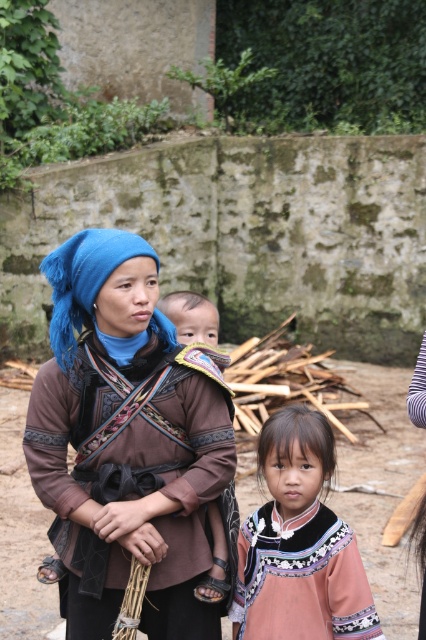
Who is positioned more to the left, blue fabric headdress at center or brown fabric baby at center?

blue fabric headdress at center

Is point (72, 280) more distant than point (198, 328)?

No.

Where is `blue fabric headdress at center`? blue fabric headdress at center is located at coordinates (83, 280).

The image size is (426, 640). What are the coordinates of `blue fabric headdress at center` in the screenshot? It's located at (83, 280).

Can you confirm if pink fabric dress at center is positioned to the left of blue fabric headdress at center?

No, pink fabric dress at center is not to the left of blue fabric headdress at center.

Which is behind, point (319, 518) or point (71, 324)?

The point (71, 324) is behind.

This screenshot has width=426, height=640. I want to click on pink fabric dress at center, so (299, 545).

Who is taller, matte brown fabric at center or brown fabric baby at center?

Standing taller between the two is matte brown fabric at center.

Does matte brown fabric at center lie in front of brown fabric baby at center?

Yes, matte brown fabric at center is in front of brown fabric baby at center.

You are a GUI agent. You are given a task and a screenshot of the screen. Output one action in this format:
    pyautogui.click(x=<x>, y=<y>)
    Task: Click on the matte brown fabric at center
    
    Given the screenshot: What is the action you would take?
    pyautogui.click(x=126, y=440)